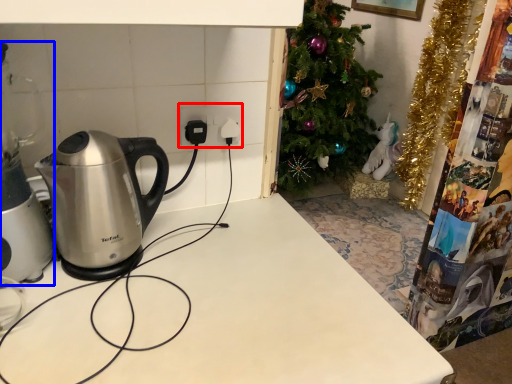
Question: Which object appears closest to the camera in this image, electric outlet (highlighted by a red box) or appliance (highlighted by a blue box)?

Choices:
 (A) electric outlet
 (B) appliance

Answer: (B)